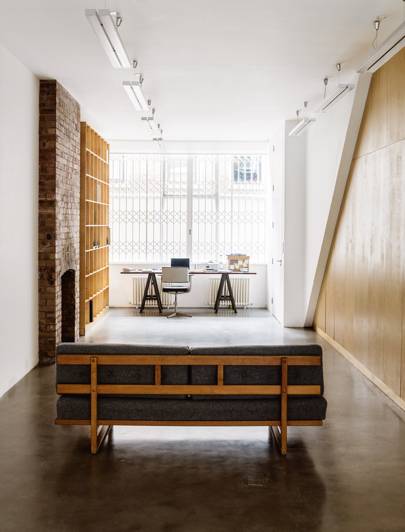
Find the location of `fireplace`. fireplace is located at coordinates (67, 322).